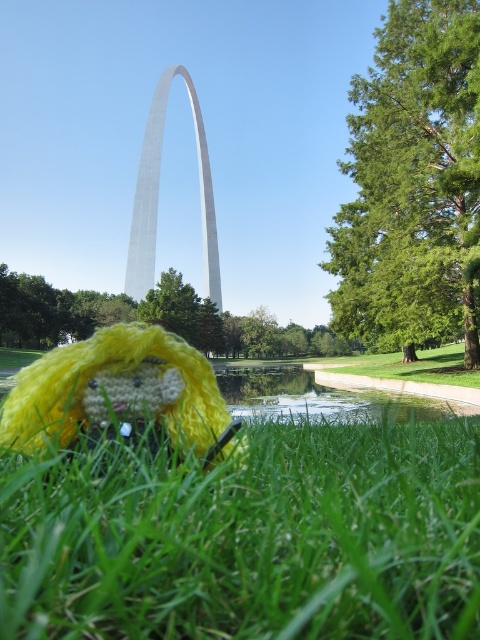
Based on the photo, you are standing in the park looking at the silver metallic gateway arch at center and the yellow yarn toy at lower left. Which object is nearer to you?

The yellow yarn toy at lower left is closer to the viewer than the silver metallic gateway arch at center.

From the picture: You are planning to place a new bench in the park scene so that it can be seen from both the yellow yarn toy at lower left and the silver metallic gateway arch at center. Based on their sizes and positions, where should the bench be placed to ensure visibility from both objects?

The bench should be placed in a central area between the yellow yarn toy at lower left and the silver metallic gateway arch at center. Since the yellow yarn toy at lower left is smaller in size compared to the silver metallic gateway arch at center, positioning the bench midway would allow visibility from both viewpoints without obstruction.

You are a small robot trying to navigate through the park to reach the arch. You notice the green fuzzy grass at lower left and the yellow yarn toy at lower left. Which object is taller and might block your path?

The green fuzzy grass at lower left is taller than the yellow yarn toy at lower left, so it might block your path.